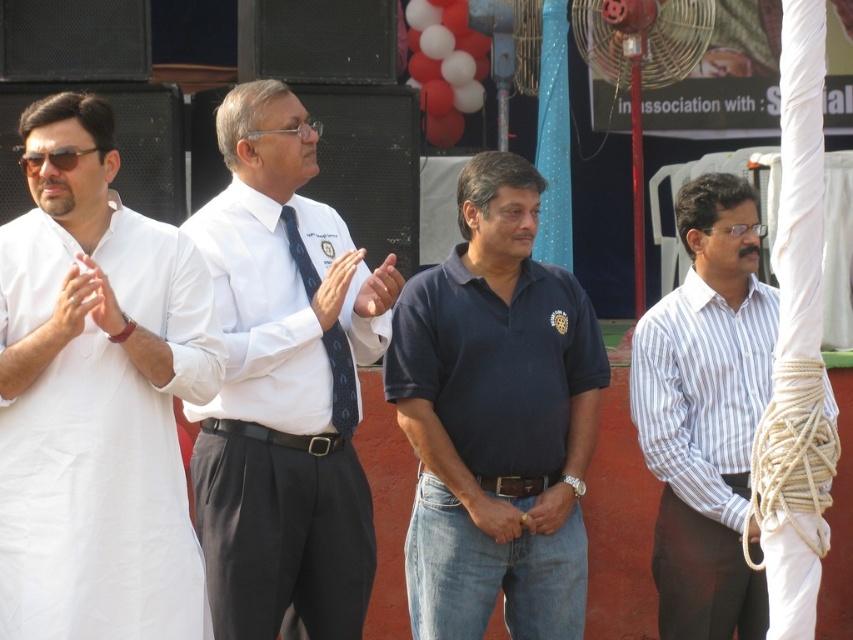
Is white shirt at center to the right of white matte hand at center from the viewer's perspective?

Correct, you'll find white shirt at center to the right of white matte hand at center.

Is white shirt at center smaller than white matte hand at center?

Incorrect, white shirt at center is not smaller in size than white matte hand at center.

Who is more distant from viewer, (318, 396) or (62, 316)?

The point (318, 396) is more distant.

Identify the location of white shirt at center. Image resolution: width=853 pixels, height=640 pixels. (280, 388).

Based on the photo, does white smooth shirt at center appear on the right side of light brown leather hand at center?

In fact, white smooth shirt at center is to the left of light brown leather hand at center.

At what (x,y) coordinates should I click in order to perform the action: click on white smooth shirt at center. Please return your answer as a coordinate pair (x, y). Looking at the image, I should click on (260, 317).

Locate an element on the screen. The image size is (853, 640). white smooth shirt at center is located at coordinates (260, 317).

Does white smooth shirt at center have a larger size compared to blue silk tie at center?

Correct, white smooth shirt at center is larger in size than blue silk tie at center.

Does point (251, 348) lie in front of point (347, 435)?

Yes, it is.

The image size is (853, 640). In order to click on white smooth shirt at center in this screenshot , I will do `click(260, 317)`.